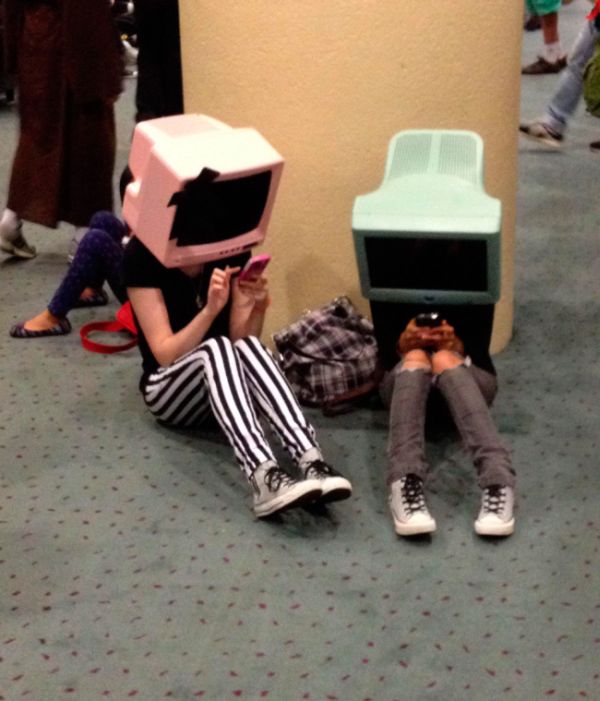
Locate an element on the screen. Image resolution: width=600 pixels, height=701 pixels. 1 white monitor is located at coordinates (179, 179).